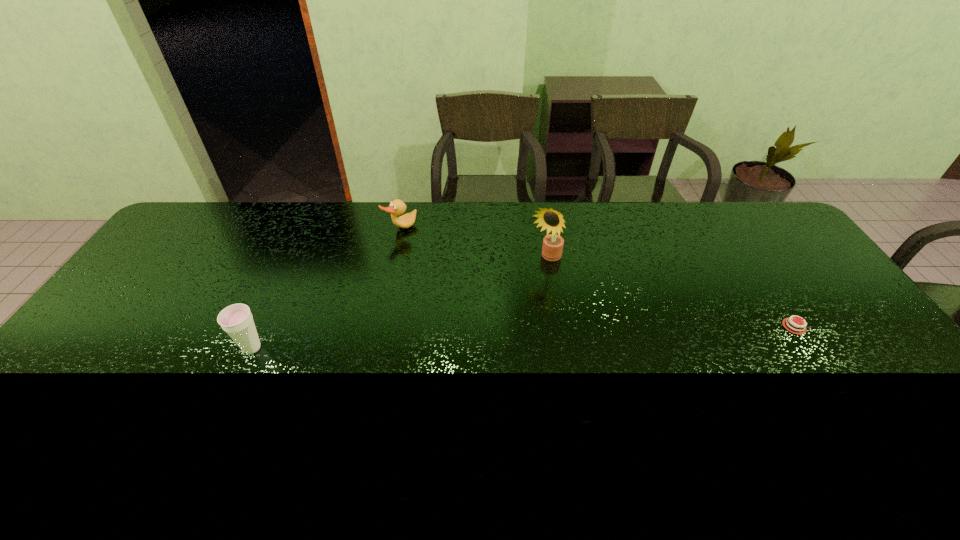
Where is `the leftmost object`? This screenshot has height=540, width=960. the leftmost object is located at coordinates (237, 320).

This screenshot has height=540, width=960. In order to click on the shortest object in this screenshot , I will do `click(793, 326)`.

I want to click on the rightmost object, so click(793, 326).

The height and width of the screenshot is (540, 960). Find the location of `sunflower`. sunflower is located at coordinates (552, 248).

Locate an element on the screen. the third nearest object is located at coordinates (552, 248).

Locate an element on the screen. the farthest object is located at coordinates (397, 207).

Where is `the second object from left to right`? The width and height of the screenshot is (960, 540). the second object from left to right is located at coordinates (397, 207).

In order to click on vacant region located on the back of the cup in this screenshot , I will do `click(290, 265)`.

At what (x,y) coordinates should I click in order to perform the action: click on vacant space located on the front of the rightmost object. Please return your answer as a coordinate pair (x, y). The width and height of the screenshot is (960, 540). Looking at the image, I should click on (843, 401).

Where is `free location located 0.310m on the face of the second farthest object`? This screenshot has width=960, height=540. free location located 0.310m on the face of the second farthest object is located at coordinates (487, 335).